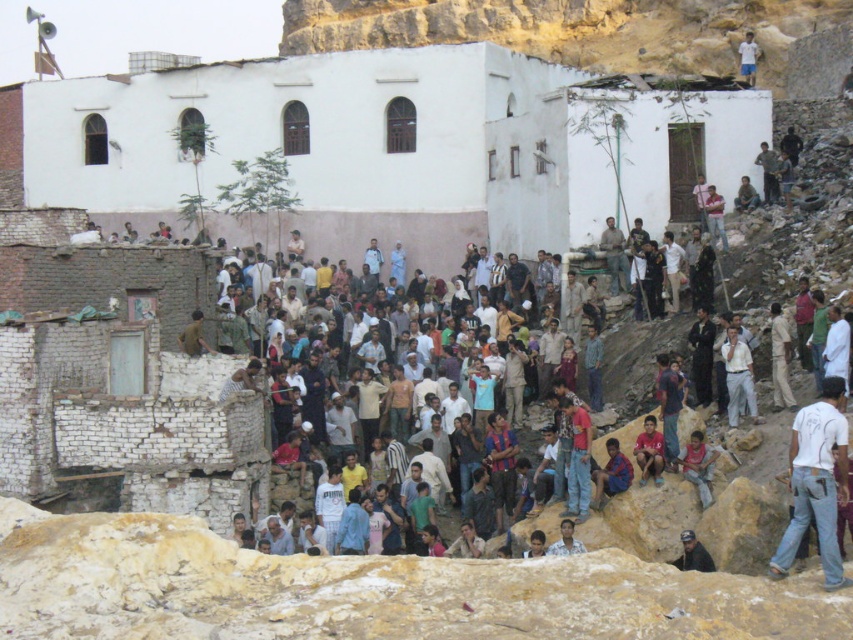
Question: Among these points, which one is nearest to the camera?

Choices:
 (A) (793, 420)
 (B) (747, 49)

Answer: (A)

Question: Which point appears closest to the camera in this image?

Choices:
 (A) (706, 557)
 (B) (703, 470)
 (C) (827, 531)

Answer: (C)

Question: Can you confirm if white rough stone wall at upper center is positioned below matte red shirt at center?

Choices:
 (A) yes
 (B) no

Answer: (B)

Question: Can you confirm if white rough stone wall at upper center is thinner than matte red shirt at center?

Choices:
 (A) no
 (B) yes

Answer: (A)

Question: Which object appears farthest from the camera in this image?

Choices:
 (A) white rough stone wall at upper center
 (B) light brown leather jacket at upper right

Answer: (A)

Question: Does matte red shirt at center have a smaller size compared to light blue shirt at center?

Choices:
 (A) yes
 (B) no

Answer: (B)